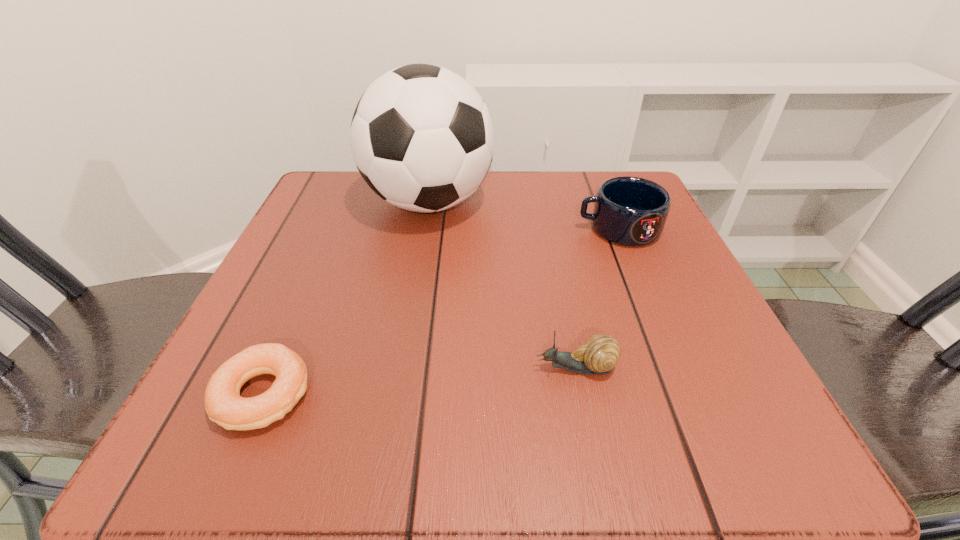
The width and height of the screenshot is (960, 540). I want to click on object that is the closest to the soccer ball, so click(x=631, y=211).